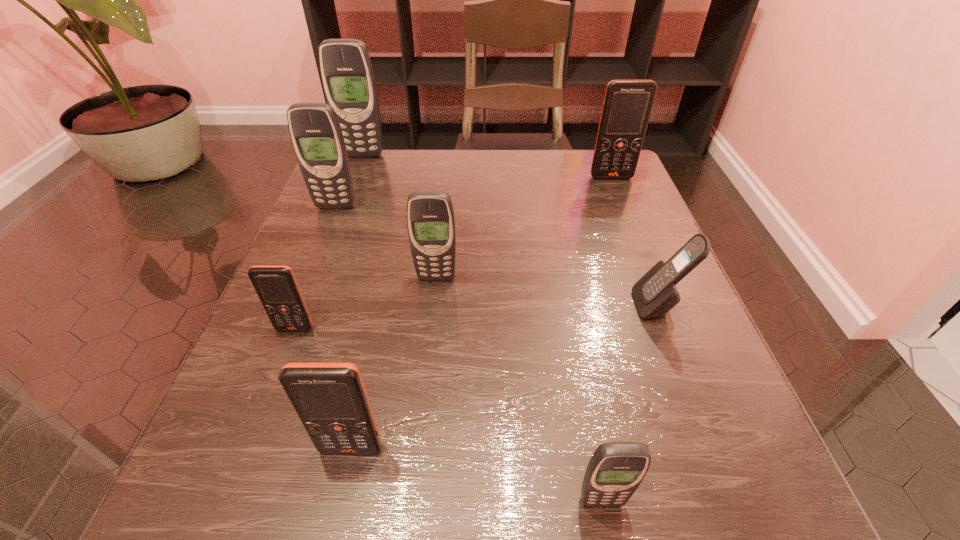
Find the location of a particular element. vacant space that satisfies the following two spatial constraints: 1. on the front-facing side of the fourth nearest cellular telephone; 2. on the screen of the second orange cellular telephone from right to left is located at coordinates (713, 448).

Identify the location of free region that satisfies the following two spatial constraints: 1. on the front-facing side of the fifth farthest cellular telephone; 2. on the screen of the rightmost gray cellular telephone. The width and height of the screenshot is (960, 540). (734, 501).

Where is `vacant area in the image that satisfies the following two spatial constraints: 1. on the front-facing side of the fifth farthest cellular telephone; 2. on the screen of the sixth object from left to right`? The image size is (960, 540). vacant area in the image that satisfies the following two spatial constraints: 1. on the front-facing side of the fifth farthest cellular telephone; 2. on the screen of the sixth object from left to right is located at coordinates (734, 501).